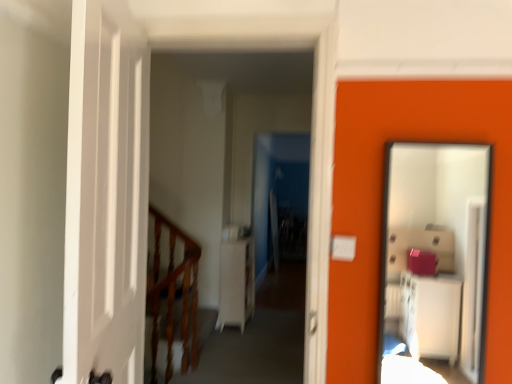
Question: Is white matte dresser at center facing towards wooden at left?

Choices:
 (A) yes
 (B) no

Answer: (B)

Question: Does white matte dresser at center appear on the right side of wooden at left?

Choices:
 (A) yes
 (B) no

Answer: (A)

Question: Considering the relative sizes of white matte dresser at center and wooden at left in the image provided, is white matte dresser at center smaller than wooden at left?

Choices:
 (A) yes
 (B) no

Answer: (B)

Question: Is the depth of white matte dresser at center less than that of wooden at left?

Choices:
 (A) no
 (B) yes

Answer: (A)

Question: Is white matte dresser at center shorter than wooden at left?

Choices:
 (A) yes
 (B) no

Answer: (A)

Question: Considering the relative sizes of white matte dresser at center and wooden at left in the image provided, is white matte dresser at center bigger than wooden at left?

Choices:
 (A) no
 (B) yes

Answer: (B)

Question: Considering the relative sizes of white glossy cabinet at center and wooden at left in the image provided, is white glossy cabinet at center smaller than wooden at left?

Choices:
 (A) yes
 (B) no

Answer: (B)

Question: Is the position of white glossy cabinet at center more distant than that of wooden at left?

Choices:
 (A) yes
 (B) no

Answer: (B)

Question: Would you say wooden at left is part of white glossy cabinet at center's contents?

Choices:
 (A) no
 (B) yes

Answer: (A)

Question: Is white glossy cabinet at center to the right of wooden at left from the viewer's perspective?

Choices:
 (A) no
 (B) yes

Answer: (B)

Question: From a real-world perspective, is white glossy cabinet at center on top of wooden at left?

Choices:
 (A) yes
 (B) no

Answer: (A)

Question: Is white glossy cabinet at center to the left of wooden at left from the viewer's perspective?

Choices:
 (A) no
 (B) yes

Answer: (A)

Question: Is the surface of white glossy cabinet at center in direct contact with smooth glass mirror at right?

Choices:
 (A) no
 (B) yes

Answer: (A)